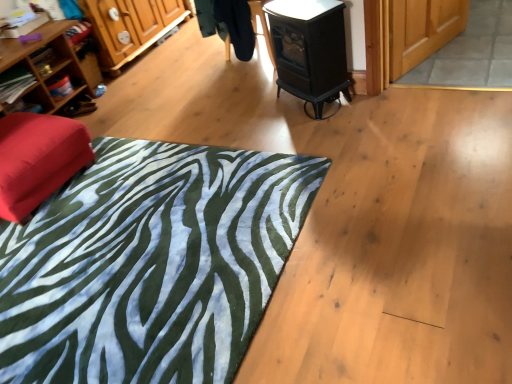
The width and height of the screenshot is (512, 384). What do you see at coordinates (15, 85) in the screenshot? I see `wooden shelf at left, the 3th shelf from the top` at bounding box center [15, 85].

Measure the distance between point (36,86) and camera.

Point (36,86) and camera are 2.69 meters apart from each other.

The height and width of the screenshot is (384, 512). I want to click on wooden shelf at left, the 2th shelf positioned from the top, so click(x=63, y=85).

Locate an element on the screen. wooden shelf at left, the first shelf in the bottom-to-top sequence is located at coordinates (15, 85).

Between wooden cabinet at left and matte wooden screen door at upper right, which one has more height?

wooden cabinet at left is taller.

Locate an element on the screen. The height and width of the screenshot is (384, 512). cabinetry lying behind the matte wooden screen door at upper right is located at coordinates (130, 26).

From a real-world perspective, which is physically below, wooden cabinet at left or matte wooden screen door at upper right?

In real-world perspective, matte wooden screen door at upper right is lower.

Between wooden cabinet at left and matte wooden screen door at upper right, which one appears on the right side from the viewer's perspective?

matte wooden screen door at upper right is more to the right.

Are matte wooden screen door at upper right and wooden cabinet at left far apart?

Yes, matte wooden screen door at upper right and wooden cabinet at left are quite far apart.

Is wooden cabinet at left at the back of matte wooden screen door at upper right?

No, matte wooden screen door at upper right is not facing the opposite direction of wooden cabinet at left.

Consider the image. Is matte wooden screen door at upper right taller than wooden cabinet at left?

No, matte wooden screen door at upper right is not taller than wooden cabinet at left.

Considering the sizes of objects wooden bookshelf at left, positioned as the first shelf in top-to-bottom order, and wooden shelf at left, arranged as the 2th shelf when ordered from the bottom, in the image provided, who is taller, wooden bookshelf at left, positioned as the first shelf in top-to-bottom order, or wooden shelf at left, arranged as the 2th shelf when ordered from the bottom,?

wooden bookshelf at left, positioned as the first shelf in top-to-bottom order.

Does point (6, 40) come behind point (61, 73)?

No, it is not.

Considering the relative sizes of matte wooden screen door at upper right and wooden shelf at left, the first shelf in the bottom-to-top sequence, in the image provided, is matte wooden screen door at upper right taller than wooden shelf at left, the first shelf in the bottom-to-top sequence,?

No, matte wooden screen door at upper right is not taller than wooden shelf at left, the first shelf in the bottom-to-top sequence.

Measure the distance from matte wooden screen door at upper right to wooden shelf at left, the 3th shelf from the top.

matte wooden screen door at upper right is 2.31 meters from wooden shelf at left, the 3th shelf from the top.

In the scene shown: Is matte wooden screen door at upper right to the left of wooden shelf at left, the 3th shelf from the top, from the viewer's perspective?

No, matte wooden screen door at upper right is not to the left of wooden shelf at left, the 3th shelf from the top.

Which is further, (413, 37) or (21, 73)?

The point (21, 73) is farther from the camera.

Identify the location of mat on the left of matte wooden screen door at upper right. (150, 264).

Relative to green zebra-patterned rug at lower left, is matte wooden screen door at upper right in front or behind?

matte wooden screen door at upper right is positioned farther from the viewer than green zebra-patterned rug at lower left.

From a real-world perspective, is matte wooden screen door at upper right under green zebra-patterned rug at lower left?

Yes, from a real-world perspective, matte wooden screen door at upper right is under green zebra-patterned rug at lower left.

From a real-world perspective, is matte red ottoman at left above or below wooden shelf at left, the 3th shelf from the top?

In terms of real-world spatial position, matte red ottoman at left is below wooden shelf at left, the 3th shelf from the top.

Based on the photo, who is taller, matte red ottoman at left or wooden shelf at left, the 3th shelf from the top?

Standing taller between the two is matte red ottoman at left.

Which of these two, matte red ottoman at left or wooden shelf at left, the 3th shelf from the top, is thinner?

wooden shelf at left, the 3th shelf from the top.

How much distance is there between matte wooden screen door at upper right and black glossy stove at upper center?

matte wooden screen door at upper right is 18.87 inches from black glossy stove at upper center.

Considering the positions of objects matte wooden screen door at upper right and black glossy stove at upper center in the image provided, who is more to the right, matte wooden screen door at upper right or black glossy stove at upper center?

matte wooden screen door at upper right.

Is matte wooden screen door at upper right turned away from black glossy stove at upper center?

No, matte wooden screen door at upper right is not facing away from black glossy stove at upper center.

Is matte wooden screen door at upper right in front of or behind black glossy stove at upper center in the image?

Visually, matte wooden screen door at upper right is located behind black glossy stove at upper center.

This screenshot has width=512, height=384. I want to click on screen door below the wooden cabinet at left (from the image's perspective), so click(422, 30).

Image resolution: width=512 pixels, height=384 pixels. What are the coordinates of `screen door to the right of wooden cabinet at left` in the screenshot? It's located at (422, 30).

Which object lies further to the anchor point green zebra-patterned rug at lower left, wooden shelf at left, the 2th shelf positioned from the top, or wooden bookshelf at left, positioned as the first shelf in top-to-bottom order?

wooden shelf at left, the 2th shelf positioned from the top, is further to green zebra-patterned rug at lower left.

Considering their positions, is wooden shelf at left, arranged as the 2th shelf when ordered from the bottom, positioned closer to wooden cabinet at left than matte red ottoman at left?

wooden shelf at left, arranged as the 2th shelf when ordered from the bottom.

Based on their spatial positions, is wooden shelf at left, the 3th shelf from the top, or green zebra-patterned rug at lower left further from matte wooden screen door at upper right?

wooden shelf at left, the 3th shelf from the top, is positioned further to the anchor matte wooden screen door at upper right.

From the image, which object appears to be farther from matte red ottoman at left, wooden cabinet at left or matte wooden screen door at upper right?

matte wooden screen door at upper right.

In the scene shown: From the image, which object appears to be nearer to matte wooden screen door at upper right, wooden shelf at left, the 2th shelf positioned from the top, or wooden cabinet at left?

wooden cabinet at left.

From the image, which object appears to be nearer to wooden shelf at left, arranged as the 2th shelf when ordered from the bottom, black glossy stove at upper center or wooden shelf at left, the 3th shelf from the top?

wooden shelf at left, the 3th shelf from the top, lies closer to wooden shelf at left, arranged as the 2th shelf when ordered from the bottom, than the other object.

Estimate the real-world distances between objects in this image. Which object is further from matte red ottoman at left, wooden cabinet at left or wooden bookshelf at left, arranged as the 3th shelf when ordered from the bottom?

wooden cabinet at left.

When comparing their distances from wooden cabinet at left, does wooden bookshelf at left, positioned as the first shelf in top-to-bottom order, or wooden shelf at left, arranged as the 2th shelf when ordered from the bottom, seem further?

Based on the image, wooden shelf at left, arranged as the 2th shelf when ordered from the bottom, appears to be further to wooden cabinet at left.

What are the coordinates of `furniture located between green zebra-patterned rug at lower left and wooden shelf at left, arranged as the 2th shelf when ordered from the bottom, in the depth direction` in the screenshot? It's located at (38, 160).

Locate an element on the screen. Image resolution: width=512 pixels, height=384 pixels. stove between green zebra-patterned rug at lower left and wooden cabinet at left from front to back is located at coordinates (309, 50).

Locate an element on the screen. The height and width of the screenshot is (384, 512). furniture situated between wooden shelf at left, the 3th shelf from the top, and matte wooden screen door at upper right from left to right is located at coordinates (38, 160).

Identify the location of shelf situated between wooden shelf at left, the 3th shelf from the top, and black glossy stove at upper center from left to right. Image resolution: width=512 pixels, height=384 pixels. (63, 85).